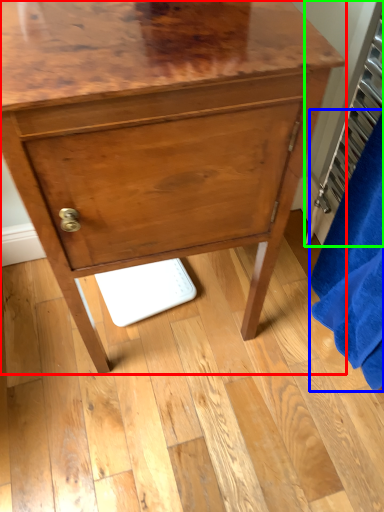
Question: Which object is positioned farthest from chest of drawers (highlighted by a red box)? Select from bath towel (highlighted by a blue box) and radiator (highlighted by a green box).

Choices:
 (A) bath towel
 (B) radiator

Answer: (B)